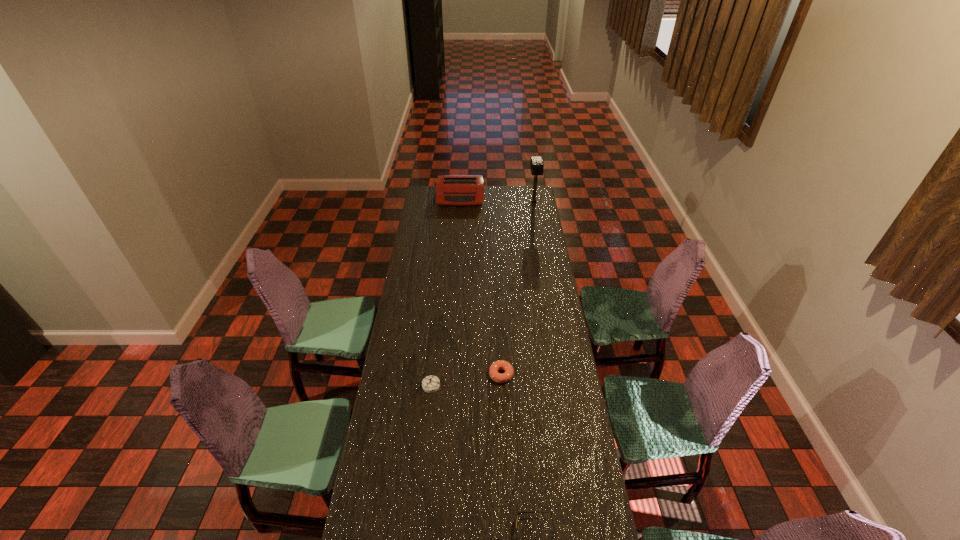
You are a GUI agent. You are given a task and a screenshot of the screen. Output one action in this format:
    pyautogui.click(x=<x>, y=<y>)
    Task: Click on the free space that satisfies the following two spatial constraints: 1. on the back side of the mallet; 2. on the right side of the second shortest object
    
    Given the screenshot: What is the action you would take?
    pyautogui.click(x=493, y=202)